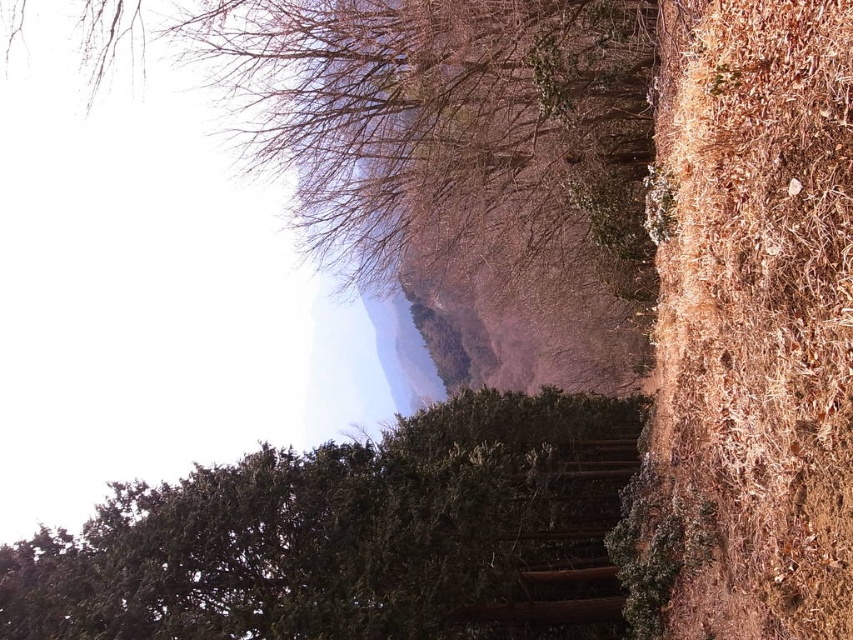
Question: Does green textured tree at center have a larger size compared to brown wooden stairs at center?

Choices:
 (A) yes
 (B) no

Answer: (A)

Question: Among these objects, which one is nearest to the camera?

Choices:
 (A) brown textured tree at upper center
 (B) brown wooden stairs at center
 (C) green textured tree at center

Answer: (C)

Question: Is brown textured tree at upper center bigger than brown wooden stairs at center?

Choices:
 (A) yes
 (B) no

Answer: (A)

Question: Which object is positioned farthest from the green textured tree at center?

Choices:
 (A) brown textured tree at upper center
 (B) brown wooden stairs at center

Answer: (A)

Question: Can you confirm if brown textured tree at upper center is bigger than brown wooden stairs at center?

Choices:
 (A) no
 (B) yes

Answer: (B)

Question: Which object is farther from the camera taking this photo?

Choices:
 (A) green textured tree at center
 (B) brown wooden stairs at center

Answer: (B)